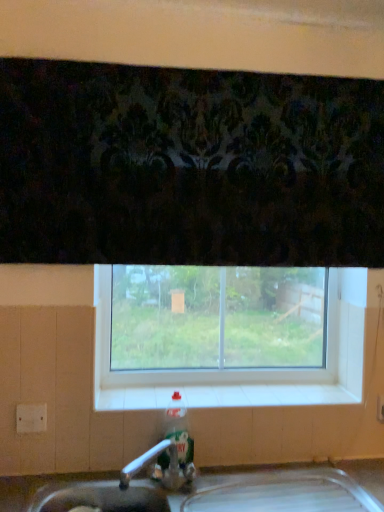
This screenshot has width=384, height=512. What are the coordinates of `vacant space situated above white tile at center (from a real-world perspective)` in the screenshot? It's located at [237, 398].